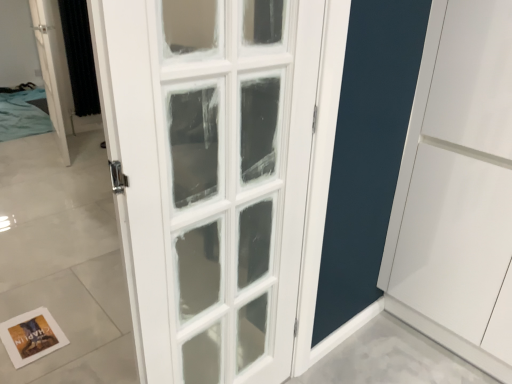
Question: From the image's perspective, is black textured curtain at left beneath white paper postcard at lower left?

Choices:
 (A) no
 (B) yes

Answer: (A)

Question: Does black textured curtain at left have a larger size compared to white paper postcard at lower left?

Choices:
 (A) yes
 (B) no

Answer: (A)

Question: Is black textured curtain at left looking in the opposite direction of white paper postcard at lower left?

Choices:
 (A) no
 (B) yes

Answer: (A)

Question: Is black textured curtain at left with white paper postcard at lower left?

Choices:
 (A) yes
 (B) no

Answer: (B)

Question: Can you confirm if black textured curtain at left is shorter than white paper postcard at lower left?

Choices:
 (A) no
 (B) yes

Answer: (A)

Question: Is point (78, 36) closer or farther from the camera than point (53, 72)?

Choices:
 (A) farther
 (B) closer

Answer: (A)

Question: Is black textured curtain at left wider or thinner than white glass door at upper left?

Choices:
 (A) thin
 (B) wide

Answer: (A)

Question: Is black textured curtain at left inside or outside of white glass door at upper left?

Choices:
 (A) outside
 (B) inside

Answer: (A)

Question: Considering their positions, is black textured curtain at left located in front of or behind white glass door at upper left?

Choices:
 (A) behind
 (B) front

Answer: (A)

Question: From their relative heights in the image, would you say black textured curtain at left is taller or shorter than white paper postcard at lower left?

Choices:
 (A) short
 (B) tall

Answer: (B)

Question: Does point (90, 97) appear closer or farther from the camera than point (30, 332)?

Choices:
 (A) farther
 (B) closer

Answer: (A)

Question: From the image's perspective, is black textured curtain at left located above or below white paper postcard at lower left?

Choices:
 (A) above
 (B) below

Answer: (A)

Question: In terms of width, does black textured curtain at left look wider or thinner when compared to white paper postcard at lower left?

Choices:
 (A) wide
 (B) thin

Answer: (B)

Question: Considering the positions of point (53, 29) and point (61, 6), is point (53, 29) closer or farther from the camera than point (61, 6)?

Choices:
 (A) closer
 (B) farther

Answer: (A)

Question: Is white glass door at upper left taller or shorter than black textured curtain at left?

Choices:
 (A) short
 (B) tall

Answer: (B)